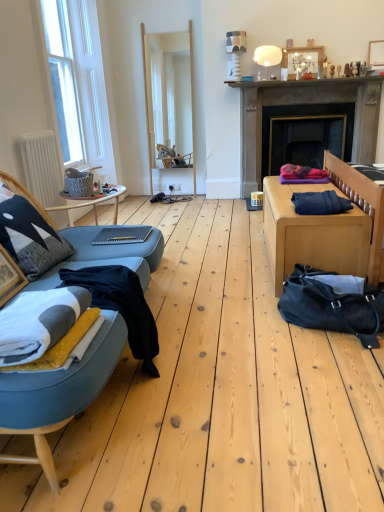
Question: From a real-world perspective, is dark blue fabric at right, the second clothing ordered from the bottom, above or below wooden frame mirror at center?

Choices:
 (A) below
 (B) above

Answer: (A)

Question: From the image's perspective, is dark blue fabric at right, arranged as the second clothing when viewed from the left, located above or below wooden frame mirror at center?

Choices:
 (A) above
 (B) below

Answer: (B)

Question: Which object is positioned closest to the matte gray table at center, which ranks as the first table in left-to-right order?

Choices:
 (A) dark gray stone fireplace at center right
 (B) dark blue fabric at right, arranged as the second clothing when viewed from the left
 (C) white wooden window at left
 (D) wooden table at right, which appears as the 1th table when viewed from the right
 (E) wooden frame mirror at center

Answer: (D)

Question: Based on their relative distances, which object is nearer to the black leather duffel bag at lower right?

Choices:
 (A) dark gray stone fireplace at center right
 (B) wooden picture frame at upper right, which is counted as the 1th picture frame, starting from the top
 (C) smooth concrete mantle at upper center
 (D) white fleece blanket at left
 (E) wooden table at right, the 2th table in the left-to-right sequence

Answer: (E)